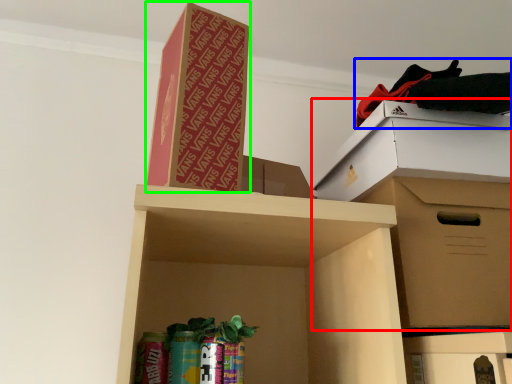
Question: Estimate the real-world distances between objects in this image. Which object is closer to cardboard box (highlighted by a red box), clothing (highlighted by a blue box) or cardboard box (highlighted by a green box)?

Choices:
 (A) clothing
 (B) cardboard box

Answer: (A)